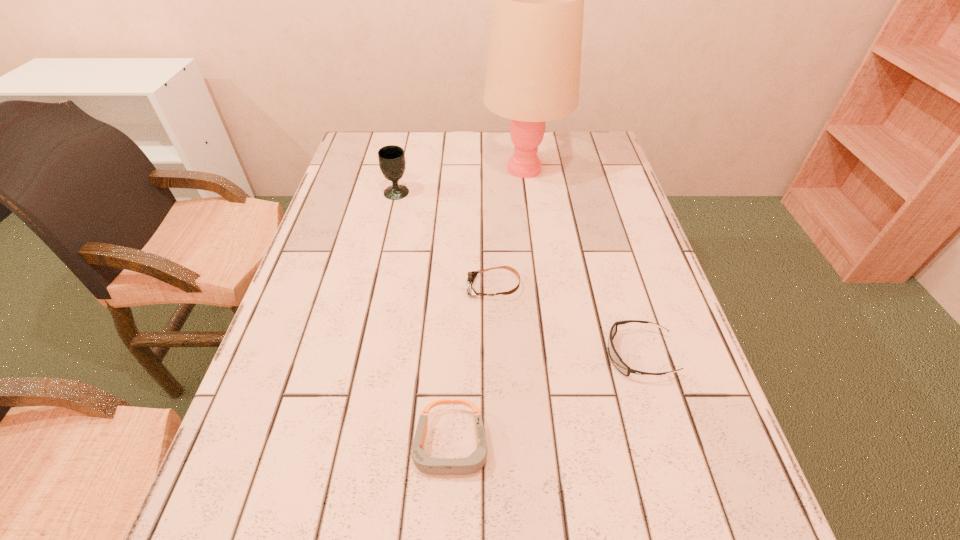
This screenshot has width=960, height=540. Identify the location of empty space that is in between the second nearest object and the lampshade. (582, 261).

This screenshot has height=540, width=960. What are the coordinates of `free area in between the nearest object and the third nearest object` in the screenshot? It's located at (472, 366).

In order to click on vacant area between the leftmost object and the lampshade in this screenshot , I will do `click(461, 180)`.

Locate an element on the screen. free area in between the tallest object and the farthest goggles is located at coordinates (509, 227).

At what (x,y) coordinates should I click in order to perform the action: click on object that can be found as the second closest to the nearest goggles. Please return your answer as a coordinate pair (x, y). This screenshot has width=960, height=540. Looking at the image, I should click on (471, 276).

Locate which object is the fourth closest to the rightmost goggles. Please provide its 2D coordinates. Your answer should be formatted as a tuple, i.e. [(x, y)], where the tuple contains the x and y coordinates of a point satisfying the conditions above.

[(392, 162)]

Locate an element on the screen. goggles that stands as the second closest to the nearest object is located at coordinates (471, 276).

Select which goggles is the second closest to the second farthest goggles. Please provide its 2D coordinates. Your answer should be formatted as a tuple, i.e. [(x, y)], where the tuple contains the x and y coordinates of a point satisfying the conditions above.

[(435, 466)]

At what (x,y) coordinates should I click in order to perform the action: click on vacant space that satisfies the following two spatial constraints: 1. on the back side of the lampshade; 2. on the left side of the chalice. Please return your answer as a coordinate pair (x, y). Looking at the image, I should click on (402, 168).

You are a GUI agent. You are given a task and a screenshot of the screen. Output one action in this format:
    pyautogui.click(x=<x>, y=<y>)
    Task: Click on the vacant space that satisfies the following two spatial constraints: 1. on the back side of the fourth shortest object; 2. on the left side of the lampshade
    Image resolution: width=960 pixels, height=540 pixels.
    Given the screenshot: What is the action you would take?
    pyautogui.click(x=402, y=168)